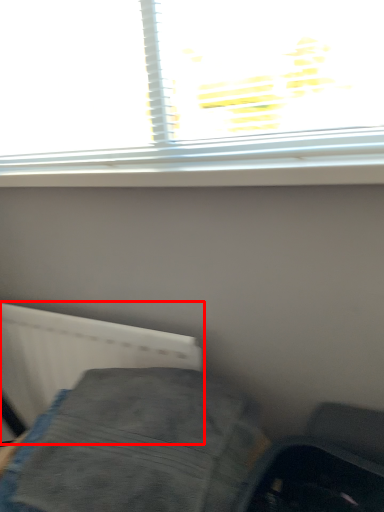
Question: From the image's perspective, what is the correct spatial relationship of radiator (annotated by the red box) in relation to furniture?

Choices:
 (A) above
 (B) below

Answer: (A)